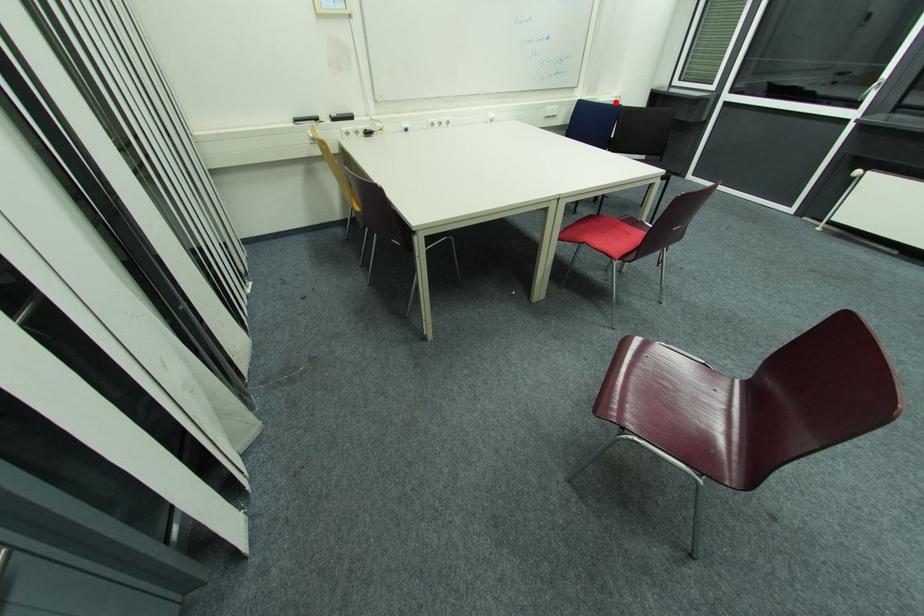
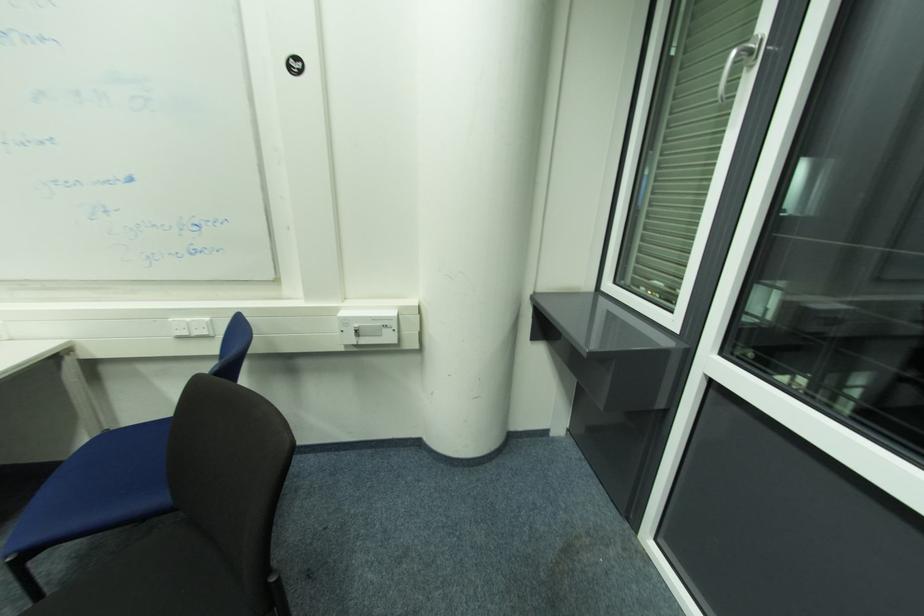
Find the pixel in the second image that matches the highlighted location in the first image.

(378, 320)